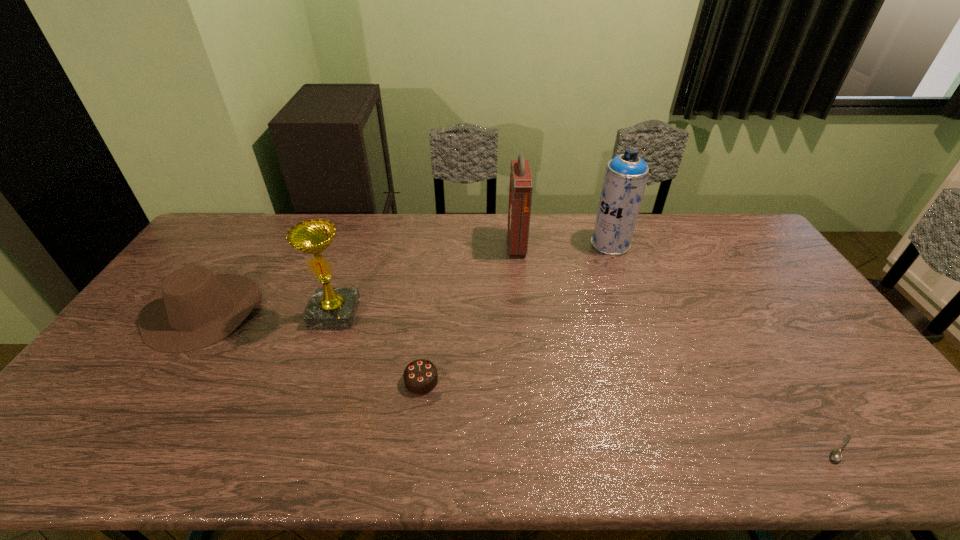
What are the coordinates of `blank area in the image that satisfies the following two spatial constraints: 1. on the front side of the second object from right to left; 2. on the front-facing side of the first-aid kit` in the screenshot? It's located at (x=611, y=245).

At what (x,y) coordinates should I click in order to perform the action: click on vacant space that satisfies the following two spatial constraints: 1. on the front-facing side of the shortest object; 2. on the left side of the second object from left to right. Please return your answer as a coordinate pair (x, y). This screenshot has height=540, width=960. Looking at the image, I should click on (288, 449).